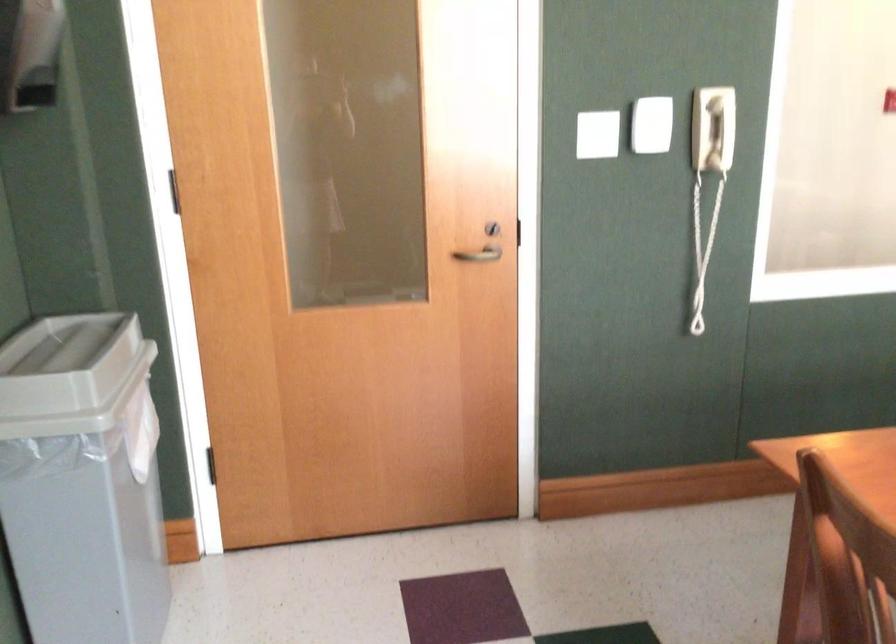
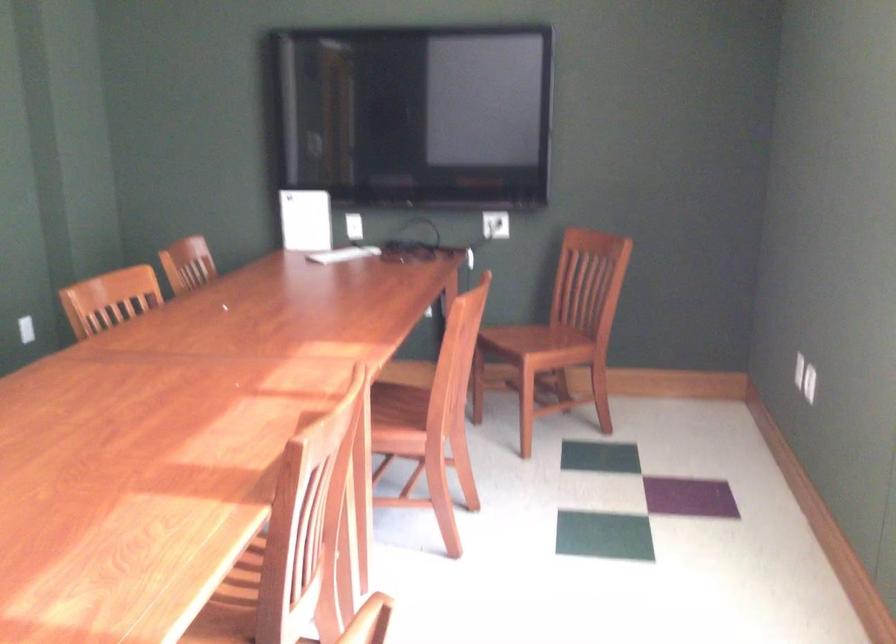
Question: Based on the continuous images, in which direction is the camera rotating? Reply with the corresponding letter.

Choices:
 (A) Left
 (B) Right
 (C) Up
 (D) Down

Answer: (B)